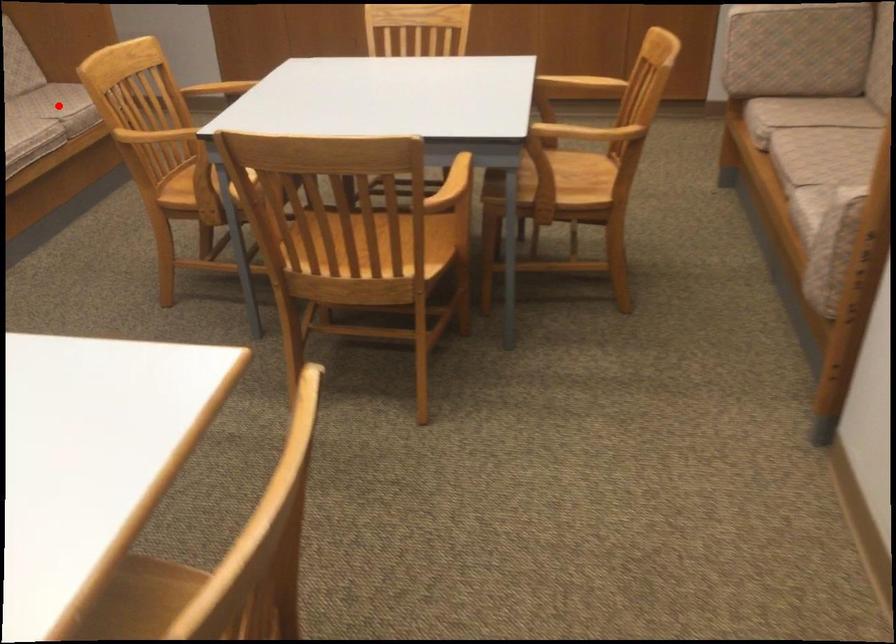
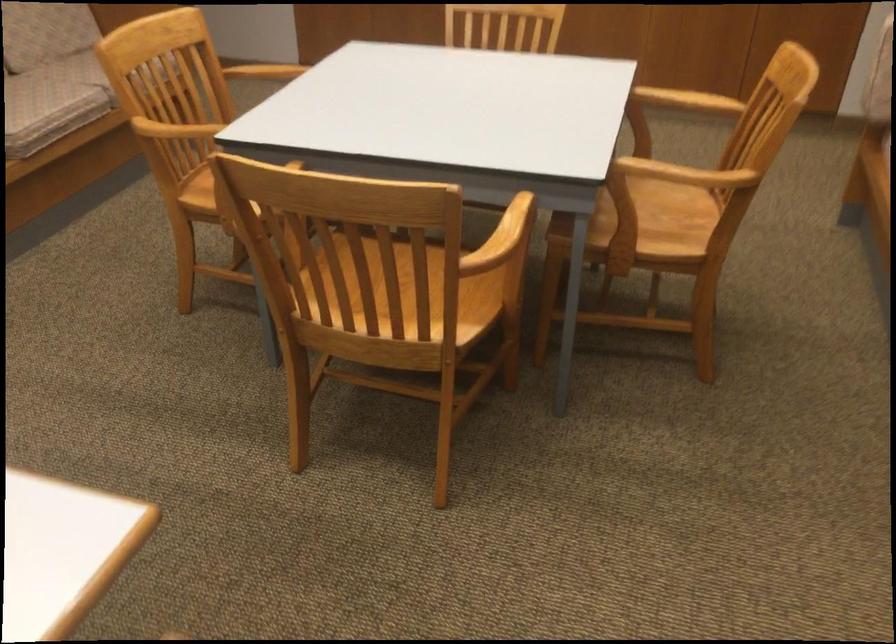
Question: I am providing you with two images of the same scene from different viewpoints. A red point is marked on the first image. Can you still see the location of the red point in image 2?

Choices:
 (A) Yes
 (B) No

Answer: (B)